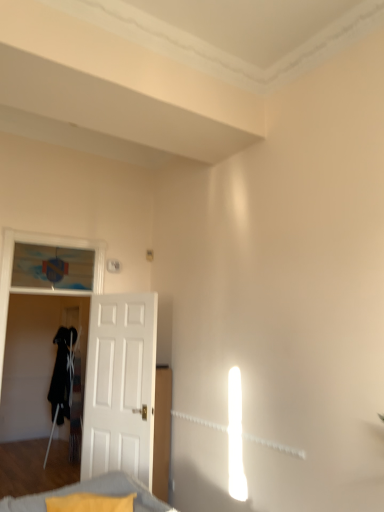
Where is `white wooden door at left`? The image size is (384, 512). white wooden door at left is located at coordinates (120, 386).

Image resolution: width=384 pixels, height=512 pixels. Describe the element at coordinates (120, 386) in the screenshot. I see `white wooden door at left` at that location.

Locate an element on the screen. Image resolution: width=384 pixels, height=512 pixels. soft gray fabric cushion at lower left is located at coordinates (91, 492).

Describe the element at coordinates (91, 492) in the screenshot. The width and height of the screenshot is (384, 512). I see `soft gray fabric cushion at lower left` at that location.

At what (x,y) coordinates should I click in order to perform the action: click on white wooden door at left. Please return your answer as a coordinate pair (x, y). Image resolution: width=384 pixels, height=512 pixels. Looking at the image, I should click on (120, 386).

Which object is positioned more to the right, white wooden door at left or soft gray fabric cushion at lower left?

soft gray fabric cushion at lower left is more to the right.

Which object is further away from the camera taking this photo, white wooden door at left or soft gray fabric cushion at lower left?

white wooden door at left is behind.

Between point (96, 446) and point (103, 479), which one is positioned behind?

The point (96, 446) is farther.

From the image's perspective, is white wooden door at left above or below soft gray fabric cushion at lower left?

white wooden door at left is situated higher than soft gray fabric cushion at lower left in the image.

From a real-world perspective, between white wooden door at left and soft gray fabric cushion at lower left, who is vertically higher?

From a 3D spatial view, white wooden door at left is above.

Is white wooden door at left thinner than soft gray fabric cushion at lower left?

Yes.

Considering the sizes of objects white wooden door at left and soft gray fabric cushion at lower left in the image provided, who is taller, white wooden door at left or soft gray fabric cushion at lower left?

Standing taller between the two is white wooden door at left.

Is white wooden door at left bigger or smaller than soft gray fabric cushion at lower left?

white wooden door at left is bigger than soft gray fabric cushion at lower left.

Would you say soft gray fabric cushion at lower left is part of white wooden door at left's contents?

Actually, soft gray fabric cushion at lower left is outside white wooden door at left.

Looking at this image, is white wooden door at left with soft gray fabric cushion at lower left?

white wooden door at left and soft gray fabric cushion at lower left are clearly separated.

Is white wooden door at left facing towards soft gray fabric cushion at lower left?

No, white wooden door at left is not turned towards soft gray fabric cushion at lower left.

How far apart are white wooden door at left and soft gray fabric cushion at lower left?

white wooden door at left is 1.20 meters away from soft gray fabric cushion at lower left.

The height and width of the screenshot is (512, 384). Identify the location of furniture beneath the white wooden door at left (from a real-world perspective). (91, 492).

Which object is positioned more to the right, soft gray fabric cushion at lower left or white wooden door at left?

Positioned to the right is soft gray fabric cushion at lower left.

Relative to white wooden door at left, is soft gray fabric cushion at lower left in front or behind?

Clearly, soft gray fabric cushion at lower left is in front of white wooden door at left.

Which is less distant, (110,490) or (91,410)?

Point (110,490) is positioned closer to the camera compared to point (91,410).

From the image's perspective, is soft gray fabric cushion at lower left located beneath white wooden door at left?

Yes, from the image's perspective, soft gray fabric cushion at lower left is below white wooden door at left.

From a real-world perspective, between soft gray fabric cushion at lower left and white wooden door at left, who is vertically lower?

In real-world perspective, soft gray fabric cushion at lower left is lower.

Considering the relative sizes of soft gray fabric cushion at lower left and white wooden door at left in the image provided, is soft gray fabric cushion at lower left thinner than white wooden door at left?

Incorrect, the width of soft gray fabric cushion at lower left is not less than that of white wooden door at left.

Considering the relative sizes of soft gray fabric cushion at lower left and white wooden door at left in the image provided, is soft gray fabric cushion at lower left shorter than white wooden door at left?

Yes.

Based on their sizes in the image, would you say soft gray fabric cushion at lower left is bigger or smaller than white wooden door at left?

In the image, soft gray fabric cushion at lower left appears to be smaller than white wooden door at left.

Choose the correct answer: Is soft gray fabric cushion at lower left inside white wooden door at left or outside it?

soft gray fabric cushion at lower left is located beyond the bounds of white wooden door at left.

Is soft gray fabric cushion at lower left touching white wooden door at left?

soft gray fabric cushion at lower left is not next to white wooden door at left, and they're not touching.

Could you tell me if soft gray fabric cushion at lower left is facing white wooden door at left?

No, soft gray fabric cushion at lower left is not facing towards white wooden door at left.

How many degrees apart are the facing directions of soft gray fabric cushion at lower left and white wooden door at left?

The angular difference between soft gray fabric cushion at lower left and white wooden door at left is 39.9 degrees.

Image resolution: width=384 pixels, height=512 pixels. Find the location of `door above the soft gray fabric cushion at lower left (from the image's perspective)`. door above the soft gray fabric cushion at lower left (from the image's perspective) is located at coordinates (120, 386).

This screenshot has height=512, width=384. Identify the location of furniture located on the right of white wooden door at left. (91, 492).

This screenshot has height=512, width=384. Identify the location of door above the soft gray fabric cushion at lower left (from the image's perspective). (120, 386).